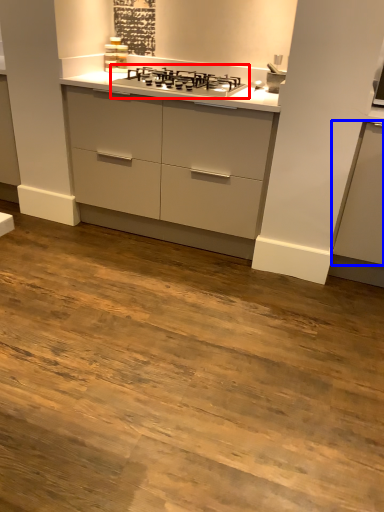
Question: Which point is closer to the camera, gas stove (highlighted by a red box) or cabinetry (highlighted by a blue box)?

Choices:
 (A) gas stove
 (B) cabinetry

Answer: (B)